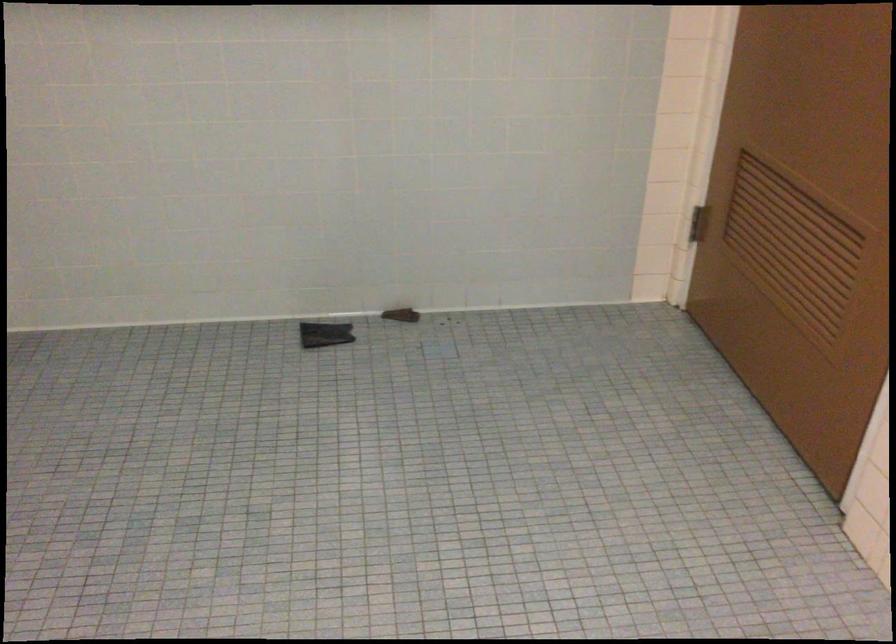
Question: Based on the continuous images, in which direction is the camera rotating? Reply with the corresponding letter.

Choices:
 (A) Left
 (B) Right
 (C) Up
 (D) Down

Answer: (A)